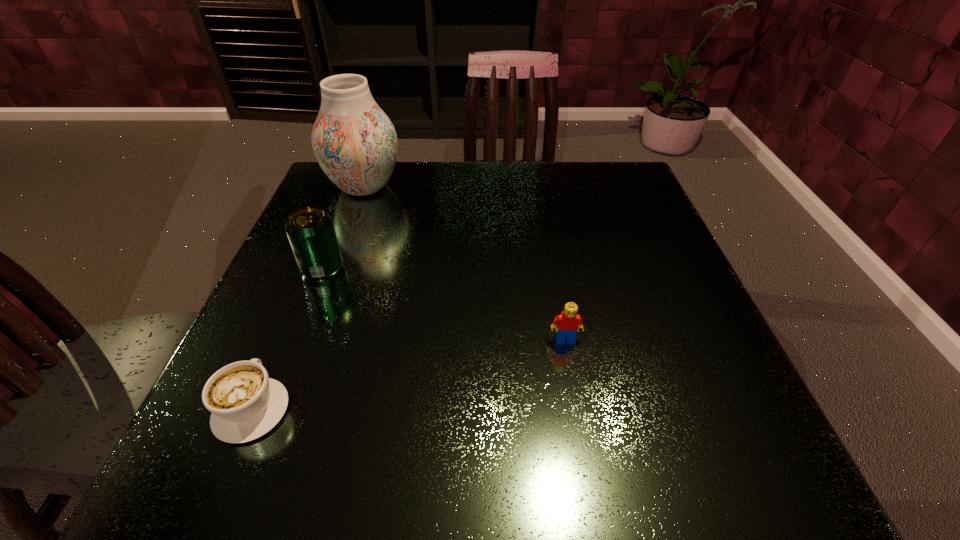
Locate an element on the screen. This screenshot has height=540, width=960. the tallest object is located at coordinates (355, 143).

This screenshot has height=540, width=960. What are the coordinates of `vase` in the screenshot? It's located at pos(355,143).

This screenshot has width=960, height=540. I want to click on the third shortest object, so click(310, 230).

The image size is (960, 540). I want to click on beer can, so click(x=310, y=230).

Locate an element on the screen. The image size is (960, 540). Lego is located at coordinates (568, 322).

Where is `the rightmost object`? the rightmost object is located at coordinates (568, 322).

You are a GUI agent. You are given a task and a screenshot of the screen. Output one action in this format:
    pyautogui.click(x=<x>, y=<y>)
    Task: Click on the nearest object
    Image resolution: width=960 pixels, height=540 pixels.
    Given the screenshot: What is the action you would take?
    pyautogui.click(x=245, y=403)

Where is `the shortest object`? The width and height of the screenshot is (960, 540). the shortest object is located at coordinates (245, 403).

At what (x,y) coordinates should I click in order to perform the action: click on vacant space located 0.190m on the right of the farthest object. Please return your answer as a coordinate pair (x, y). The height and width of the screenshot is (540, 960). Looking at the image, I should click on (481, 187).

Locate an element on the screen. blank area located on the back of the second tallest object is located at coordinates (334, 239).